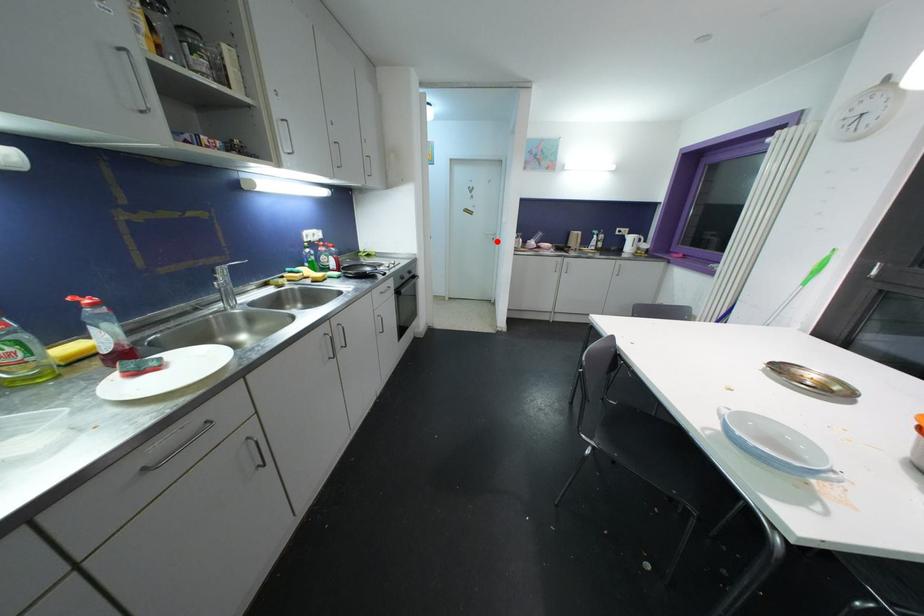
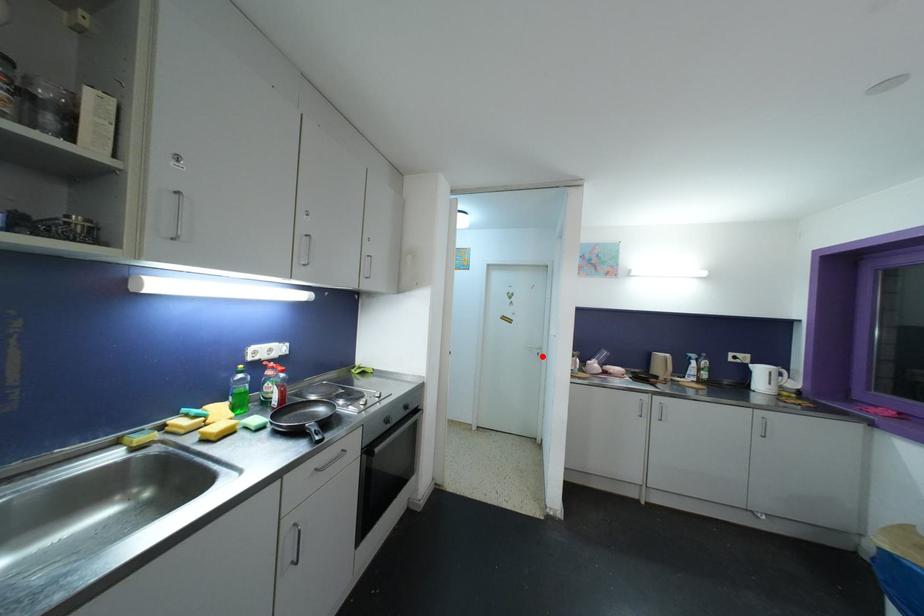
I am providing you with two images of the same scene from different viewpoints. A red point is marked on the first image and another point is marked on the second image. Is the red point in image1 aligned with the point shown in image2?

Yes